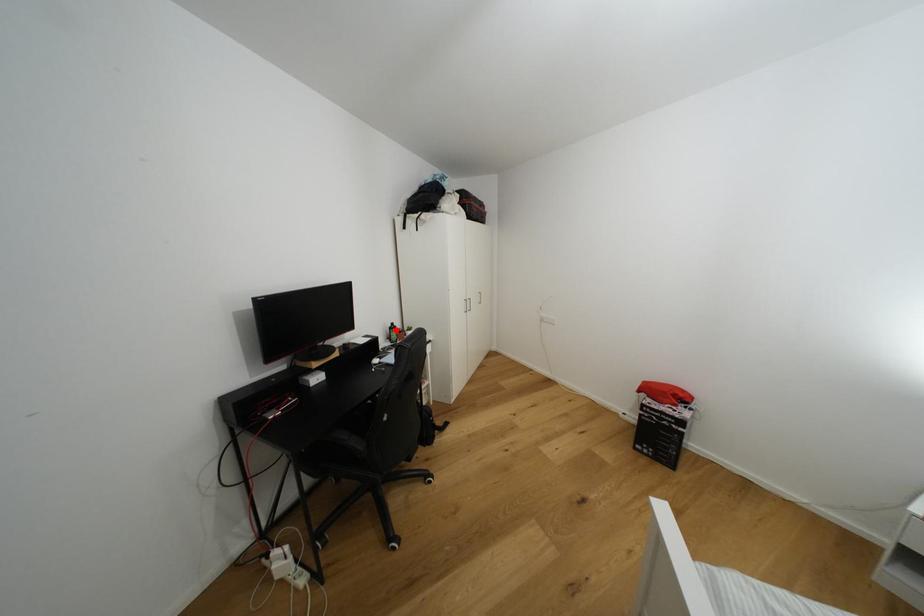
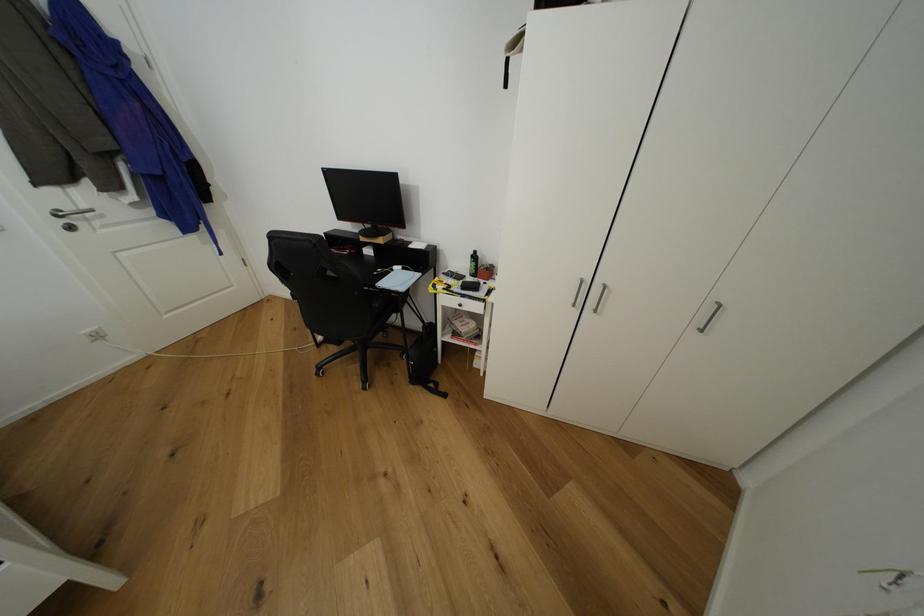
In the second image, find the point that corresponds to the highlighted location in the first image.

(478, 257)